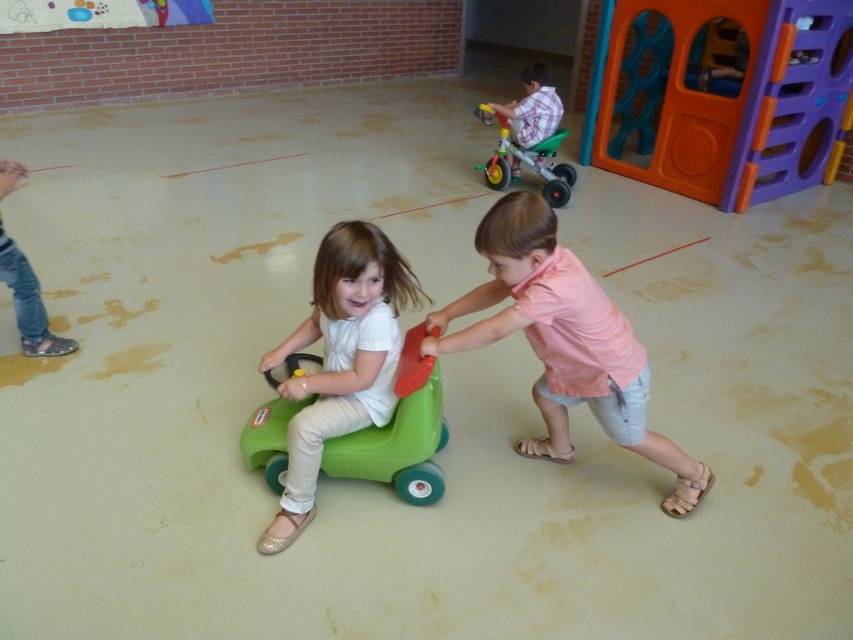
Between pink cotton shirt at center and green matte toy car at center, which one is positioned lower?

pink cotton shirt at center is below.

Is the position of pink cotton shirt at center more distant than that of green matte toy car at center?

No.

Which is behind, point (534, 305) or point (326, 426)?

Positioned behind is point (326, 426).

At what (x,y) coordinates should I click in order to perform the action: click on pink cotton shirt at center. Please return your answer as a coordinate pair (x, y). The height and width of the screenshot is (640, 853). Looking at the image, I should click on (563, 340).

Does orange plastic playhouse at right have a greater height compared to green plastic tricycle at upper right?

Yes.

Locate an element on the screen. orange plastic playhouse at right is located at coordinates (740, 100).

You are a GUI agent. You are given a task and a screenshot of the screen. Output one action in this format:
    pyautogui.click(x=<x>, y=<y>)
    Task: Click on the orange plastic playhouse at right
    The height and width of the screenshot is (640, 853).
    Given the screenshot: What is the action you would take?
    pyautogui.click(x=740, y=100)

Does point (489, 173) come closer to viewer compared to point (553, 128)?

No.

What do you see at coordinates (527, 161) in the screenshot?
I see `green plastic tricycle at upper right` at bounding box center [527, 161].

Who is more distant from viewer, (554, 177) or (521, 84)?

Positioned behind is point (521, 84).

At what (x,y) coordinates should I click in order to perform the action: click on green plastic tricycle at upper right. Please return your answer as a coordinate pair (x, y). This screenshot has width=853, height=640. Looking at the image, I should click on (527, 161).